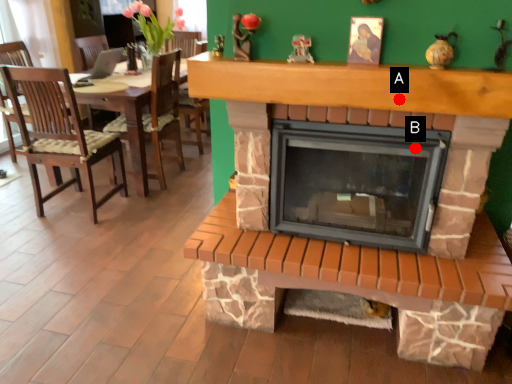
Question: Two points are circled on the image, labeled by A and B beside each circle. Which of the following is the closest to the observer?

Choices:
 (A) A is closer
 (B) B is closer

Answer: (A)